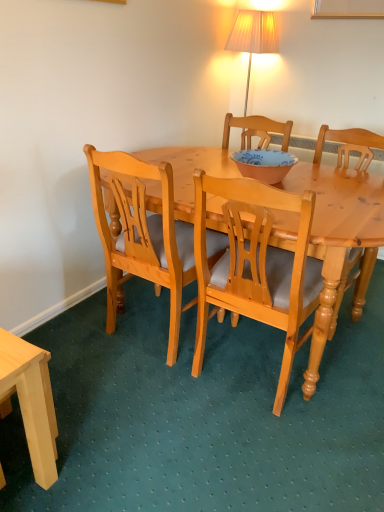
Where is `free spot in front of light wood chair at center, which is counted as the second chair, starting from the left`? free spot in front of light wood chair at center, which is counted as the second chair, starting from the left is located at coordinates (278, 455).